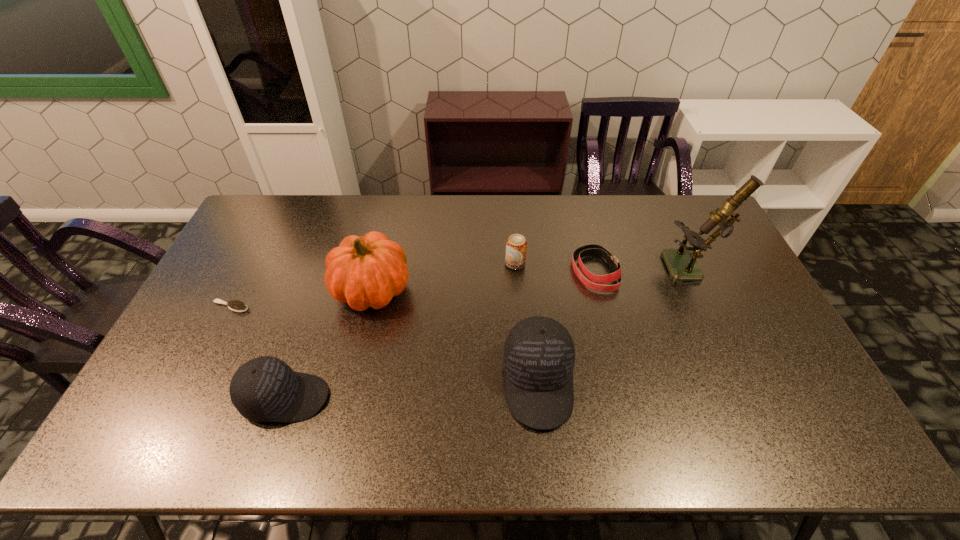
Locate an element on the screen. Image resolution: width=960 pixels, height=540 pixels. the shorter baseball cap is located at coordinates (265, 389).

What are the coordinates of `the taller baseball cap` in the screenshot? It's located at (538, 358).

The image size is (960, 540). In order to click on the third tallest object in this screenshot , I will do `click(538, 358)`.

Find the location of `pumpkin`. pumpkin is located at coordinates (368, 271).

Locate an element on the screen. microscope is located at coordinates (681, 263).

At what (x,y) coordinates should I click in order to perform the action: click on the rightmost object. Please return your answer as a coordinate pair (x, y). The height and width of the screenshot is (540, 960). Looking at the image, I should click on (681, 263).

Where is `beer can`? This screenshot has height=540, width=960. beer can is located at coordinates (516, 246).

The width and height of the screenshot is (960, 540). In order to click on the leftmost object in this screenshot , I will do `click(235, 305)`.

Image resolution: width=960 pixels, height=540 pixels. What are the coordinates of `scrubbing brush` in the screenshot? It's located at (235, 305).

Find the location of a particular element. This screenshot has height=540, width=960. dog collar is located at coordinates (592, 249).